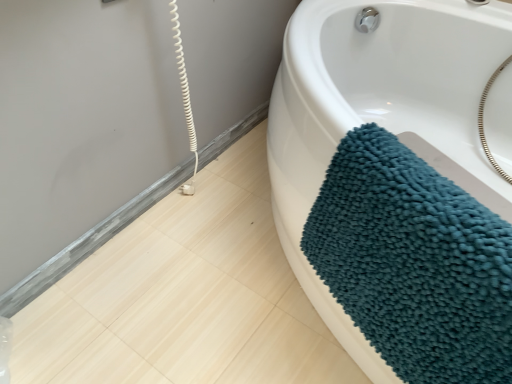
This screenshot has width=512, height=384. Describe the element at coordinates (380, 113) in the screenshot. I see `teal chenille bath mat at lower right` at that location.

Where is `teal chenille bath mat at lower right`? Image resolution: width=512 pixels, height=384 pixels. teal chenille bath mat at lower right is located at coordinates (380, 113).

This screenshot has height=384, width=512. In order to click on teal chenille bath mat at lower right in this screenshot , I will do `click(380, 113)`.